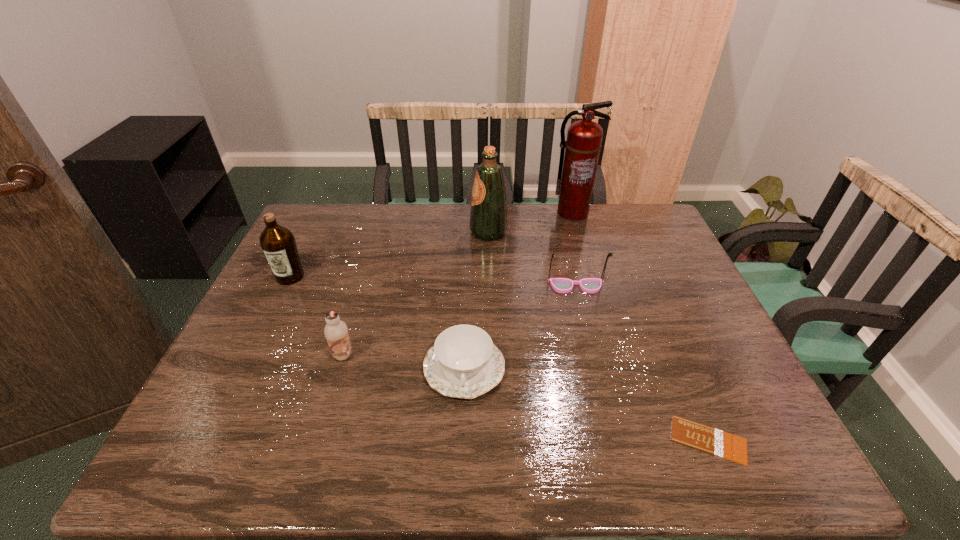
The height and width of the screenshot is (540, 960). In order to click on free space at the far left corner in this screenshot , I will do `click(337, 204)`.

At what (x,y) coordinates should I click in order to perform the action: click on free space at the near right corner. Please return your answer as a coordinate pair (x, y). Image resolution: width=960 pixels, height=540 pixels. Looking at the image, I should click on (751, 455).

Locate an element on the screen. Image resolution: width=960 pixels, height=540 pixels. free space between the chinaware and the spectacles is located at coordinates (520, 327).

Identify the location of vacant area that lies between the tallest object and the chinaware. The image size is (960, 540). (518, 290).

Identify the location of unoccupied position between the spectacles and the sixth tallest object. (520, 327).

Locate an element on the screen. The height and width of the screenshot is (540, 960). free space between the chocolate milk and the tallest object is located at coordinates (458, 284).

Identify the location of free space between the right olive oil and the chocolate bar. (598, 336).

The height and width of the screenshot is (540, 960). What are the coordinates of `vacant space that is in between the chocolate milk and the nearer olive oil` in the screenshot? It's located at (317, 316).

This screenshot has height=540, width=960. In order to click on unoccupied area between the left olive oil and the spectacles in this screenshot , I will do `click(433, 281)`.

Locate an element on the screen. The width and height of the screenshot is (960, 540). unoccupied position between the fire extinguisher and the chocolate milk is located at coordinates (458, 284).